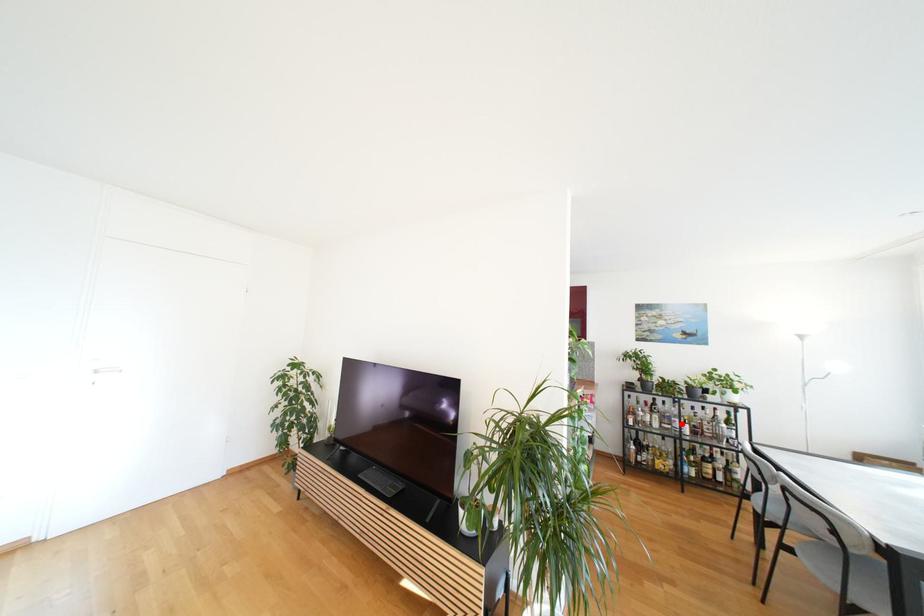
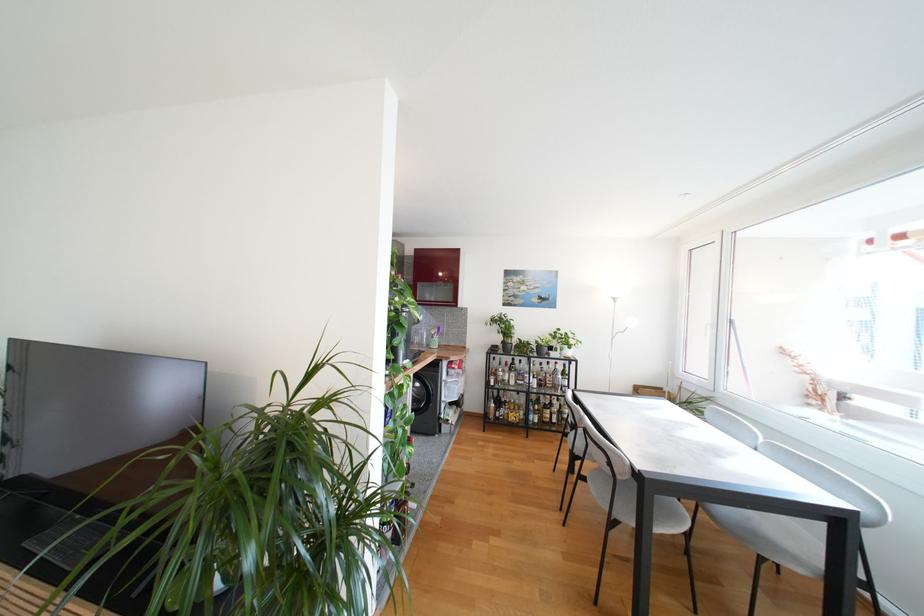
Question: I am providing you with two images of the same scene from different viewpoints. In image1, a red point is highlighted. Considering the same 3D point in image2, which of the following is correct?

Choices:
 (A) It is closer
 (B) It is farther

Answer: (B)